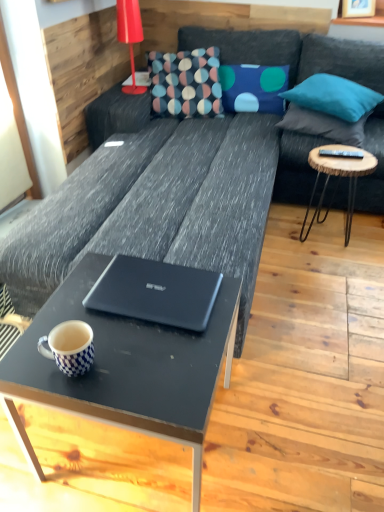
The image size is (384, 512). Identify the location of free space behind white checkered mug at lower left. (81, 316).